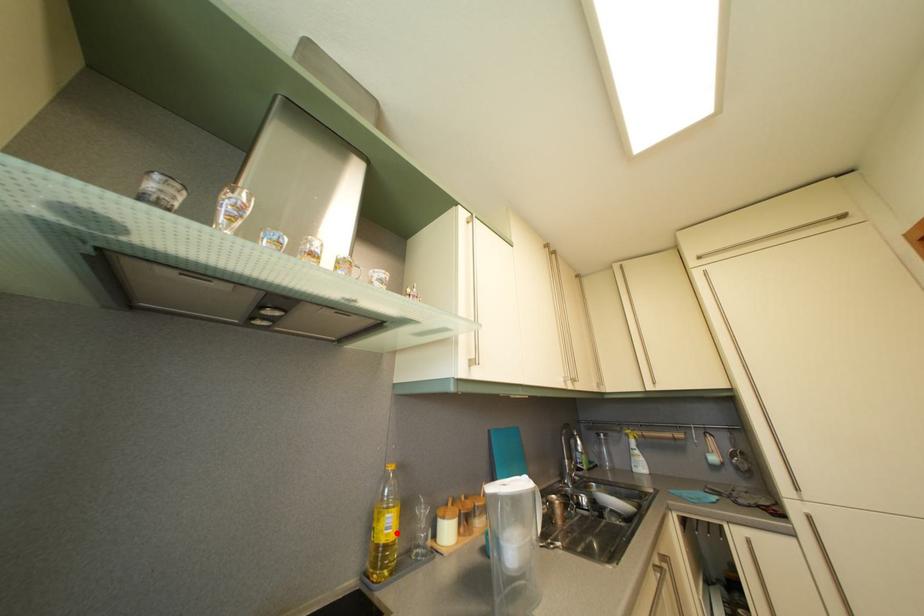
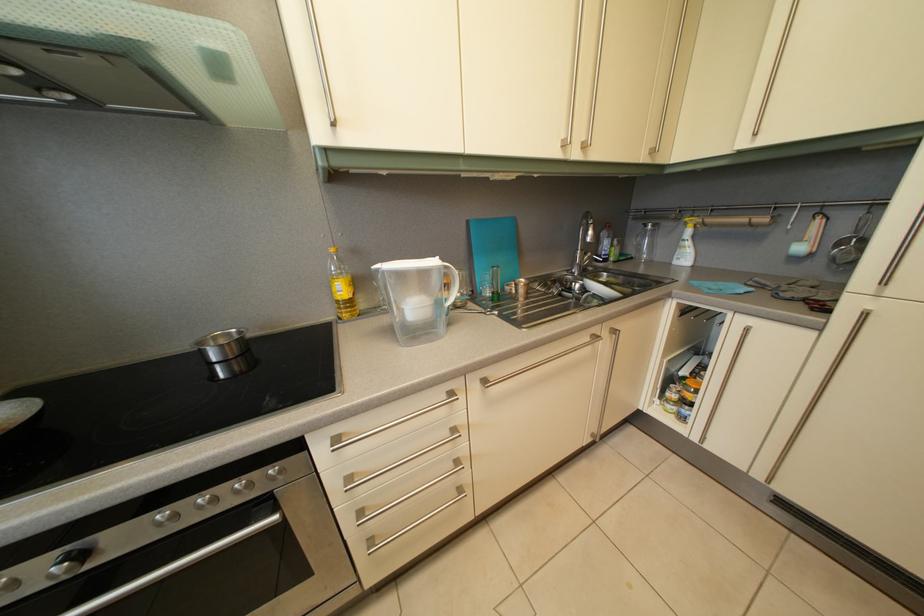
In the second image, find the point that corresponds to the highlighted location in the first image.

(349, 297)